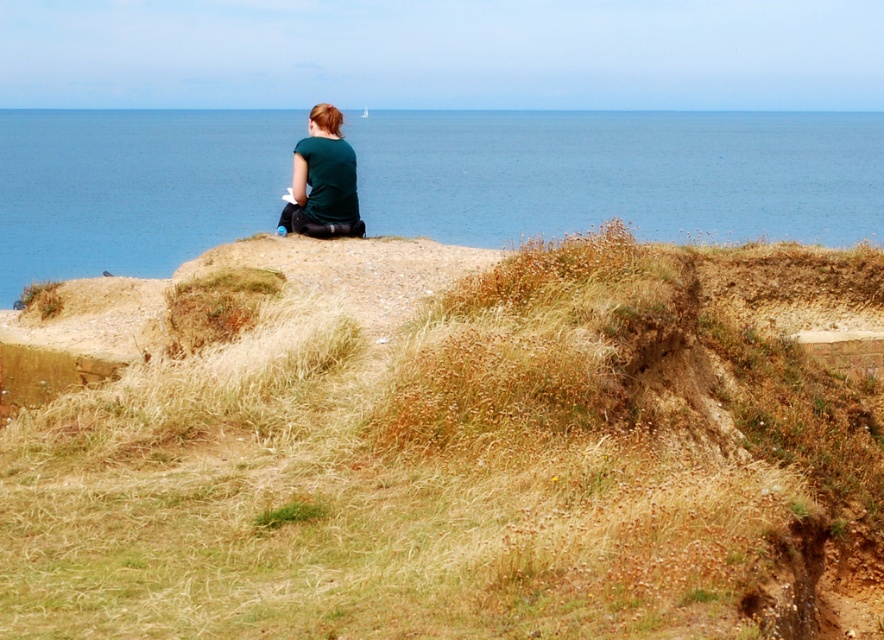
You are standing at the base of the cliff and want to climb up to the top. There are two paths available. The first path goes through the brown grassy hillside at upper center, and the second path goes around the matte green shirt at center. Which path would be safer to avoid loose soil and rocks?

The path through the brown grassy hillside at upper center is safer because it is located to the right of the matte green shirt at center, which is near the cliff edge with exposed earth and small rocks. The hillside may have more stable ground with grass cover.

You are standing on a cliff and see the blue water at upper center and the matte green shirt at center. Which object is wider in the image?

The blue water at upper center is wider than the matte green shirt at center according to the description.

You are a hiker who wants to climb up the brown grassy hillside at upper center to get a better view of the blue water at upper center. Based on the height difference between them, will you need to climb higher or lower to reach the top of the hillside?

The brown grassy hillside at upper center is not as tall as the blue water at upper center, so you will need to climb lower to reach the top of the brown grassy hillside at upper center.